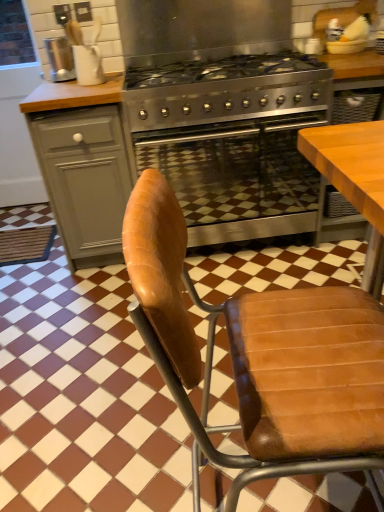
Question: From a real-world perspective, is metallic silver kettle at upper left positioned over stainless steel gas stove at center based on gravity?

Choices:
 (A) no
 (B) yes

Answer: (B)

Question: Does metallic silver kettle at upper left have a smaller size compared to stainless steel gas stove at center?

Choices:
 (A) no
 (B) yes

Answer: (B)

Question: Is metallic silver kettle at upper left to the left of stainless steel gas stove at center from the viewer's perspective?

Choices:
 (A) no
 (B) yes

Answer: (B)

Question: Is metallic silver kettle at upper left closer to the viewer compared to stainless steel gas stove at center?

Choices:
 (A) yes
 (B) no

Answer: (B)

Question: Is metallic silver kettle at upper left oriented towards stainless steel gas stove at center?

Choices:
 (A) no
 (B) yes

Answer: (A)

Question: In terms of size, does brown leather chair at center appear bigger or smaller than stainless steel oven at center?

Choices:
 (A) small
 (B) big

Answer: (A)

Question: Does point (145, 175) appear closer or farther from the camera than point (278, 202)?

Choices:
 (A) farther
 (B) closer

Answer: (B)

Question: Is brown leather chair at center taller or shorter than stainless steel oven at center?

Choices:
 (A) tall
 (B) short

Answer: (A)

Question: From the image's perspective, is brown leather chair at center located above or below stainless steel oven at center?

Choices:
 (A) below
 (B) above

Answer: (A)

Question: From a real-world perspective, is matte gray cabinet at left above or below stainless steel oven at center?

Choices:
 (A) below
 (B) above

Answer: (B)

Question: From the image's perspective, is matte gray cabinet at left located above or below stainless steel oven at center?

Choices:
 (A) below
 (B) above

Answer: (B)

Question: Is point (69, 225) closer or farther from the camera than point (205, 187)?

Choices:
 (A) farther
 (B) closer

Answer: (A)

Question: Is matte gray cabinet at left taller or shorter than stainless steel oven at center?

Choices:
 (A) tall
 (B) short

Answer: (A)

Question: Is stainless steel gas stove at center taller or shorter than brown leather chair at center?

Choices:
 (A) tall
 (B) short

Answer: (B)

Question: From the image's perspective, is stainless steel gas stove at center above or below brown leather chair at center?

Choices:
 (A) above
 (B) below

Answer: (A)